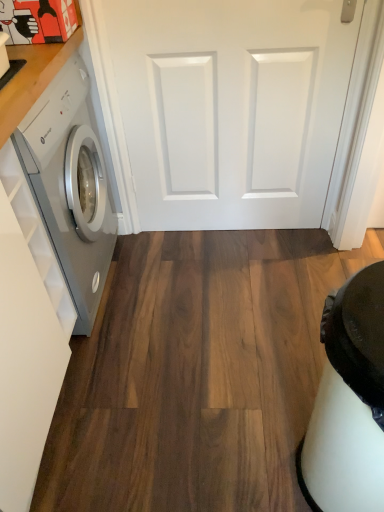
Question: In terms of height, does white matte door at center look taller or shorter compared to satin white washing machine at left?

Choices:
 (A) short
 (B) tall

Answer: (A)

Question: Do you think white matte door at center is within satin white washing machine at left, or outside of it?

Choices:
 (A) outside
 (B) inside

Answer: (A)

Question: Based on their positions, is white matte door at center located to the left or right of satin white washing machine at left?

Choices:
 (A) right
 (B) left

Answer: (A)

Question: Is satin white washing machine at left wider or thinner than white matte door at center?

Choices:
 (A) thin
 (B) wide

Answer: (B)

Question: Is satin white washing machine at left taller or shorter than white matte door at center?

Choices:
 (A) short
 (B) tall

Answer: (B)

Question: In the image, is satin white washing machine at left positioned in front of or behind white matte door at center?

Choices:
 (A) behind
 (B) front

Answer: (B)

Question: Considering the positions of satin white washing machine at left and white matte door at center in the image, is satin white washing machine at left bigger or smaller than white matte door at center?

Choices:
 (A) big
 (B) small

Answer: (A)